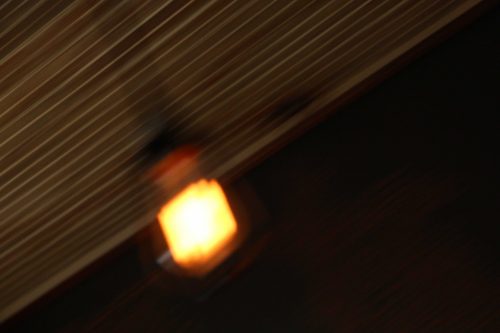
Identify the location of ceiling paneling. (115, 116).